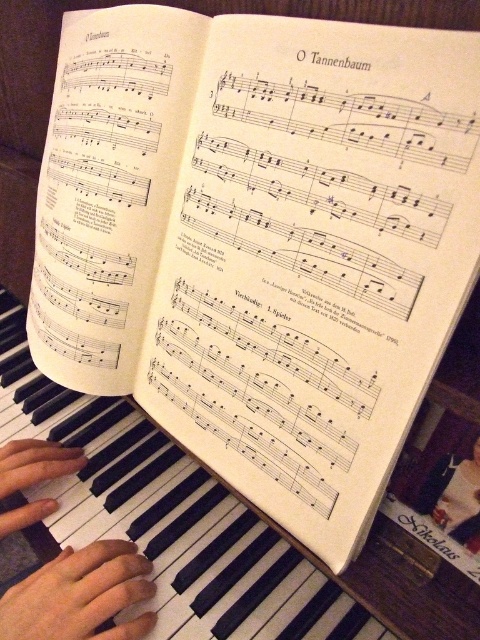
Does smooth skin hands at piano keys have a larger size compared to smooth skin hand at piano keys left?

Yes.

Consider the image. Is smooth skin hands at piano keys positioned before smooth skin hand at piano keys left?

Yes, it is.

Identify the location of smooth skin hands at piano keys. The height and width of the screenshot is (640, 480). (80, 595).

Image resolution: width=480 pixels, height=640 pixels. What are the coordinates of `smooth skin hands at piano keys` in the screenshot? It's located at (80, 595).

Which of these two, black matte piano keys at center or skinny flesh-toned hand at piano keys, stands shorter?

With less height is skinny flesh-toned hand at piano keys.

Which is in front, point (292, 600) or point (122, 602)?

Point (122, 602)

Between point (192, 589) and point (87, 625), which one is positioned in front?

Point (87, 625) is more forward.

I want to click on black matte piano keys at center, so click(166, 516).

Is point (68, 547) behind point (39, 442)?

No.

Can you confirm if skinny flesh-toned hand at piano keys is positioned to the right of smooth skin hand at piano keys left?

Yes, skinny flesh-toned hand at piano keys is to the right of smooth skin hand at piano keys left.

Is point (8, 608) more distant than point (16, 529)?

No.

At what (x,y) coordinates should I click in order to perform the action: click on skinny flesh-toned hand at piano keys. Please return your answer as a coordinate pair (x, y). This screenshot has width=480, height=640. Looking at the image, I should click on (80, 595).